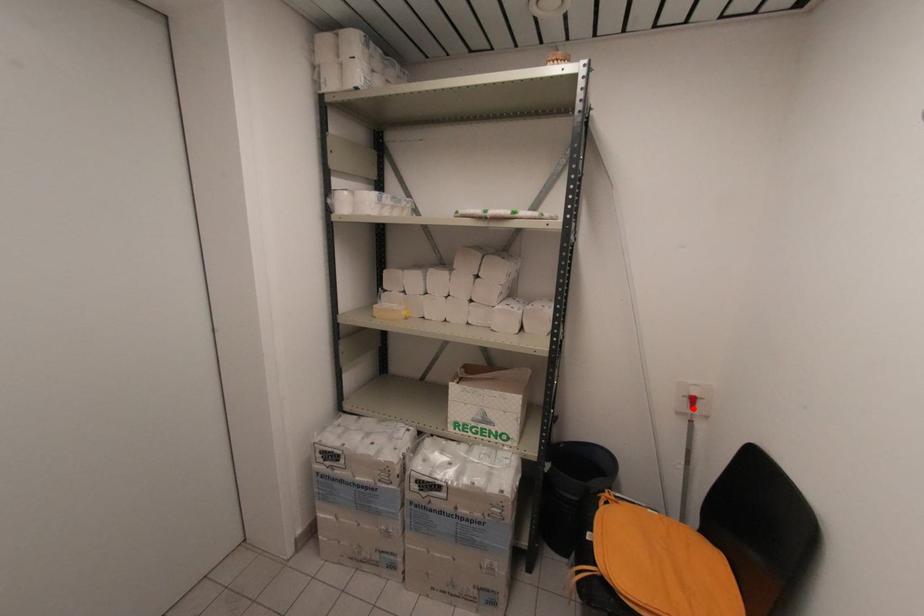
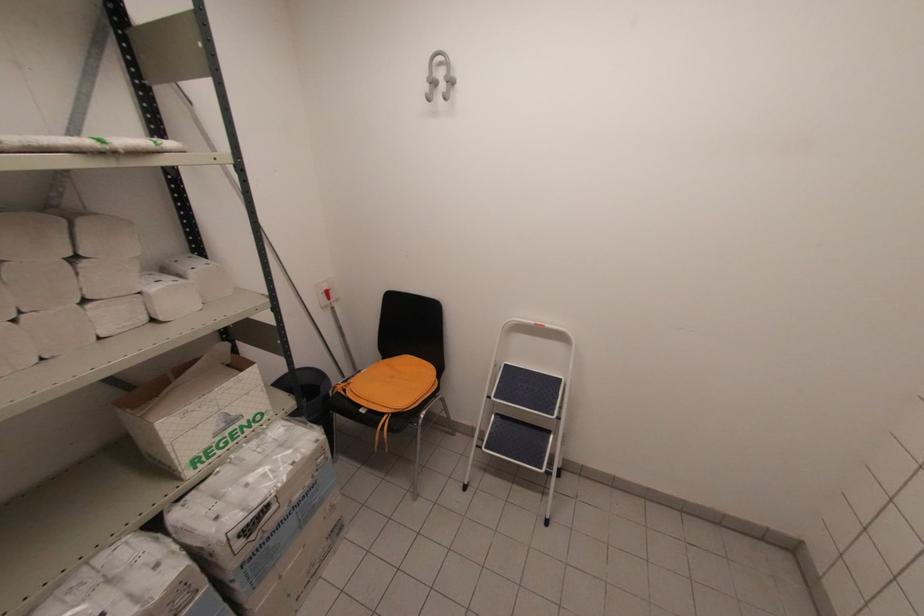
Question: A red point is marked in image1. In image2, is the corresponding 3D point closer to the camera or farther? Reply with the corresponding letter.

Choices:
 (A) The corresponding 3D point is closer.
 (B) The corresponding 3D point is farther.

Answer: (A)